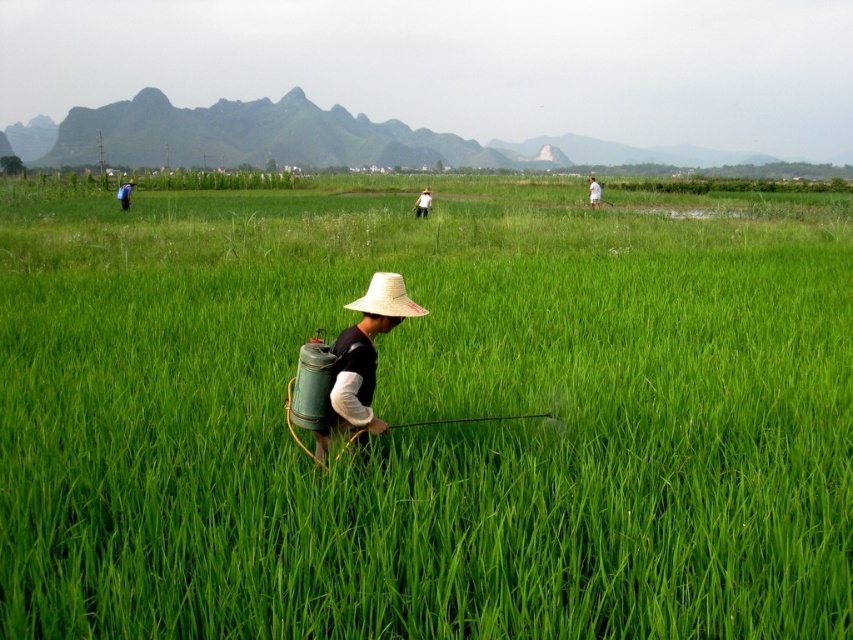
Question: Is straw hat at center to the right of blue fabric shirt at left from the viewer's perspective?

Choices:
 (A) yes
 (B) no

Answer: (A)

Question: Estimate the real-world distances between objects in this image. Which object is farther from the matte straw hat at center?

Choices:
 (A) straw hat at center
 (B) white fabric person at center
 (C) blue fabric shirt at left
 (D) green grass at center

Answer: (B)

Question: Which of the following is the closest to the observer?

Choices:
 (A) (326, 449)
 (B) (398, 278)

Answer: (B)

Question: Does green grass at center have a lesser width compared to white straw hat at center?

Choices:
 (A) yes
 (B) no

Answer: (B)

Question: Estimate the real-world distances between objects in this image. Which object is closer to the matte straw hat at center?

Choices:
 (A) straw hat at center
 (B) green grass at center
 (C) blue fabric shirt at left

Answer: (A)

Question: Is green grass at center positioned behind blue fabric shirt at left?

Choices:
 (A) no
 (B) yes

Answer: (A)